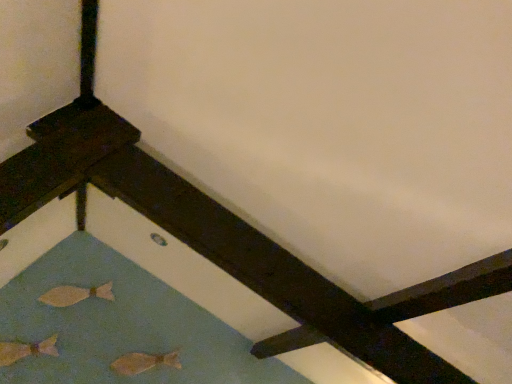
Question: Can you confirm if matte beige fish at lower left, which is the first fish from top to bottom, is shorter than matte gold fish at lower left, which ranks as the 1th fish in left-to-right order?

Choices:
 (A) no
 (B) yes

Answer: (B)

Question: Is matte beige fish at lower left, which ranks as the 2th fish in left-to-right order, thinner than matte gold fish at lower left, acting as the 2th fish starting from the bottom?

Choices:
 (A) yes
 (B) no

Answer: (A)

Question: Does matte beige fish at lower left, the 2th fish viewed from the right, have a smaller size compared to matte gold fish at lower left, acting as the 2th fish starting from the bottom?

Choices:
 (A) no
 (B) yes

Answer: (B)

Question: Can you confirm if matte beige fish at lower left, acting as the third fish starting from the bottom, is taller than matte gold fish at lower left, positioned as the 3th fish in right-to-left order?

Choices:
 (A) no
 (B) yes

Answer: (A)

Question: Is matte beige fish at lower left, the 2th fish viewed from the right, at the left side of matte gold fish at lower left, the second fish from the top?

Choices:
 (A) no
 (B) yes

Answer: (A)

Question: Is matte beige fish at lower left, the 2th fish viewed from the right, located outside matte gold fish at lower left, which ranks as the 1th fish in left-to-right order?

Choices:
 (A) yes
 (B) no

Answer: (A)

Question: Is matte gold fish at lower left, the second fish from the top, in contact with matte beige fish at lower left, positioned as the first fish in bottom-to-top order?

Choices:
 (A) no
 (B) yes

Answer: (A)

Question: Would you say matte beige fish at lower left, the 1th fish viewed from the right, is part of matte gold fish at lower left, positioned as the 3th fish in right-to-left order,'s contents?

Choices:
 (A) yes
 (B) no

Answer: (B)

Question: Does matte gold fish at lower left, which ranks as the 1th fish in left-to-right order, have a lesser height compared to matte beige fish at lower left, which is the third fish in left-to-right order?

Choices:
 (A) yes
 (B) no

Answer: (B)

Question: Is matte gold fish at lower left, the second fish from the top, further to the viewer compared to matte beige fish at lower left, which is the third fish in left-to-right order?

Choices:
 (A) no
 (B) yes

Answer: (A)

Question: Is matte gold fish at lower left, which ranks as the 1th fish in left-to-right order, thinner than matte beige fish at lower left, the 1th fish viewed from the right?

Choices:
 (A) no
 (B) yes

Answer: (A)

Question: Can you confirm if matte gold fish at lower left, which ranks as the 1th fish in left-to-right order, is smaller than matte beige fish at lower left, positioned as the first fish in bottom-to-top order?

Choices:
 (A) yes
 (B) no

Answer: (B)

Question: Does matte beige fish at lower left, which is the 3th fish from top to bottom, appear on the right side of matte gold fish at lower left, acting as the 2th fish starting from the bottom?

Choices:
 (A) no
 (B) yes

Answer: (B)